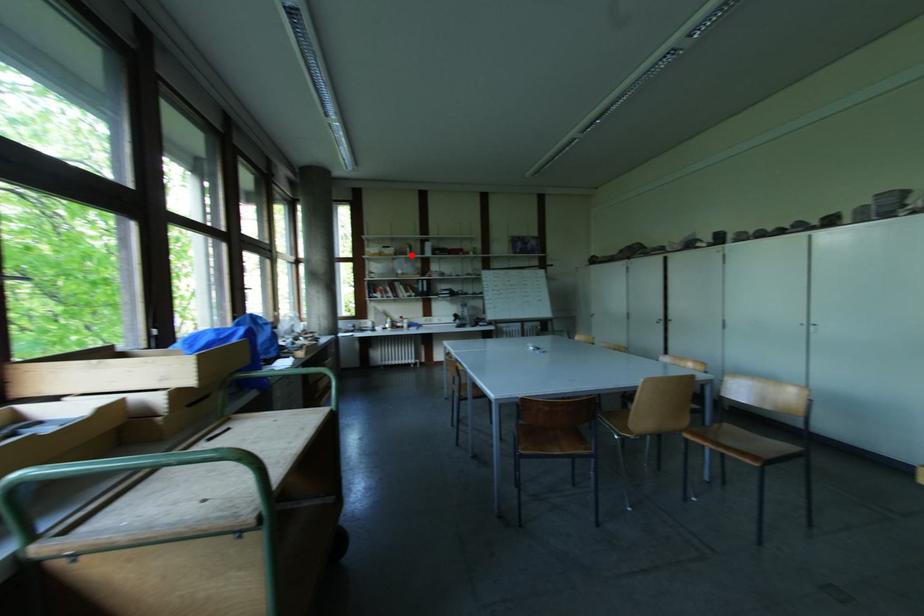
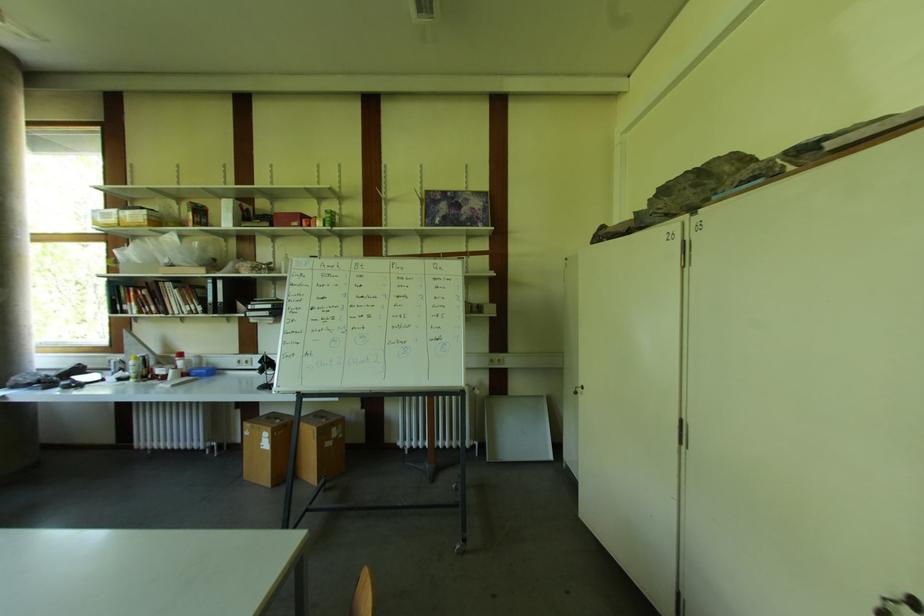
Question: A red point is marked in image1. In image2, is the corresponding 3D point closer to the camera or farther? Reply with the corresponding letter.

Choices:
 (A) The corresponding 3D point is closer.
 (B) The corresponding 3D point is farther.

Answer: (B)